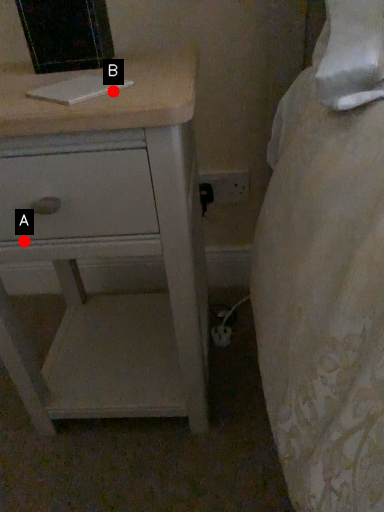
Question: Two points are circled on the image, labeled by A and B beside each circle. Which point is closer to the camera?

Choices:
 (A) A is closer
 (B) B is closer

Answer: (B)